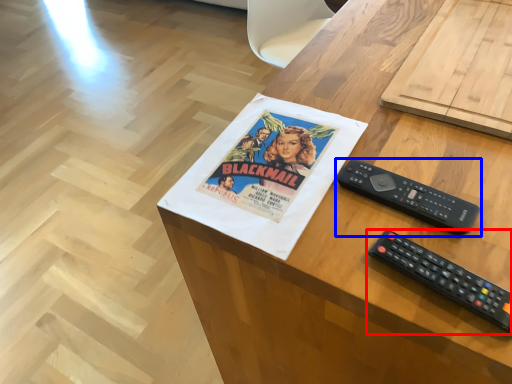
Question: Which object is closer to the camera taking this photo, remote control (highlighted by a red box) or remote control (highlighted by a blue box)?

Choices:
 (A) remote control
 (B) remote control

Answer: (A)